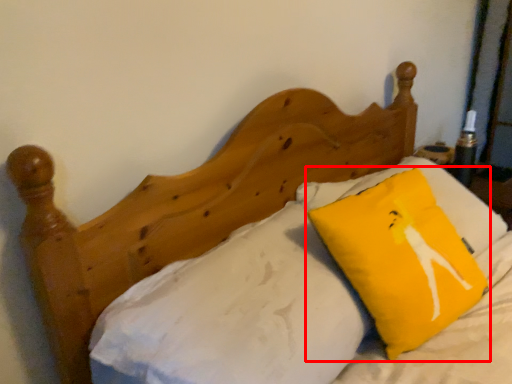
Question: From the image's perspective, considering the relative positions of pillow (annotated by the red box) and sheet in the image provided, where is pillow (annotated by the red box) located with respect to the staircase?

Choices:
 (A) below
 (B) above

Answer: (B)